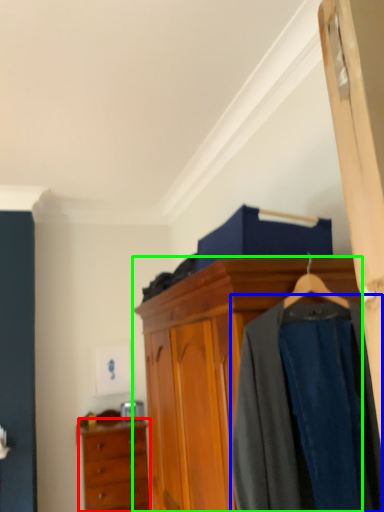
Question: Which is farther away from chest of drawers (highlighted by a red box)? clothing (highlighted by a blue box) or cabinetry (highlighted by a green box)?

Choices:
 (A) clothing
 (B) cabinetry

Answer: (A)